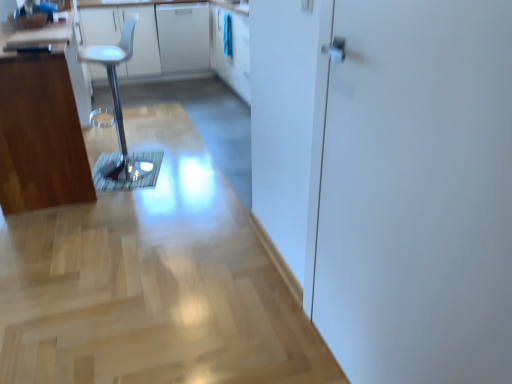
Question: Is white glossy counter top at upper left smaller than white glossy cabinet at upper center, the first cabinetry viewed from the top?

Choices:
 (A) yes
 (B) no

Answer: (B)

Question: Is white glossy cabinet at upper center, positioned as the 2th cabinetry in front-to-back order, located within white glossy counter top at upper left?

Choices:
 (A) no
 (B) yes

Answer: (B)

Question: Considering the relative sizes of white glossy counter top at upper left and white glossy cabinet at upper center, the second cabinetry positioned from the bottom, in the image provided, is white glossy counter top at upper left wider than white glossy cabinet at upper center, the second cabinetry positioned from the bottom,?

Choices:
 (A) no
 (B) yes

Answer: (A)

Question: Could you tell me if white glossy counter top at upper left is turned towards white glossy cabinet at upper center, the second cabinetry positioned from the bottom?

Choices:
 (A) yes
 (B) no

Answer: (A)

Question: Is white glossy counter top at upper left touching white glossy cabinet at upper center, positioned as the 2th cabinetry in front-to-back order?

Choices:
 (A) yes
 (B) no

Answer: (B)

Question: Is white glossy counter top at upper left turned away from white glossy cabinet at upper center, the first cabinetry viewed from the top?

Choices:
 (A) no
 (B) yes

Answer: (B)

Question: Is white glossy door at right looking in the opposite direction of white glossy counter top at upper left?

Choices:
 (A) no
 (B) yes

Answer: (A)

Question: Considering the relative sizes of white glossy door at right and white glossy counter top at upper left in the image provided, is white glossy door at right bigger than white glossy counter top at upper left?

Choices:
 (A) yes
 (B) no

Answer: (B)

Question: Is the surface of white glossy door at right in direct contact with white glossy counter top at upper left?

Choices:
 (A) no
 (B) yes

Answer: (A)

Question: Considering the relative positions of white glossy door at right and white glossy counter top at upper left in the image provided, is white glossy door at right to the right of white glossy counter top at upper left from the viewer's perspective?

Choices:
 (A) no
 (B) yes

Answer: (B)

Question: From a real-world perspective, is white glossy door at right over white glossy counter top at upper left?

Choices:
 (A) yes
 (B) no

Answer: (A)

Question: Does white glossy door at right come behind white glossy counter top at upper left?

Choices:
 (A) no
 (B) yes

Answer: (A)

Question: Is white glossy door at right looking in the opposite direction of white plastic stool at left?

Choices:
 (A) yes
 (B) no

Answer: (B)